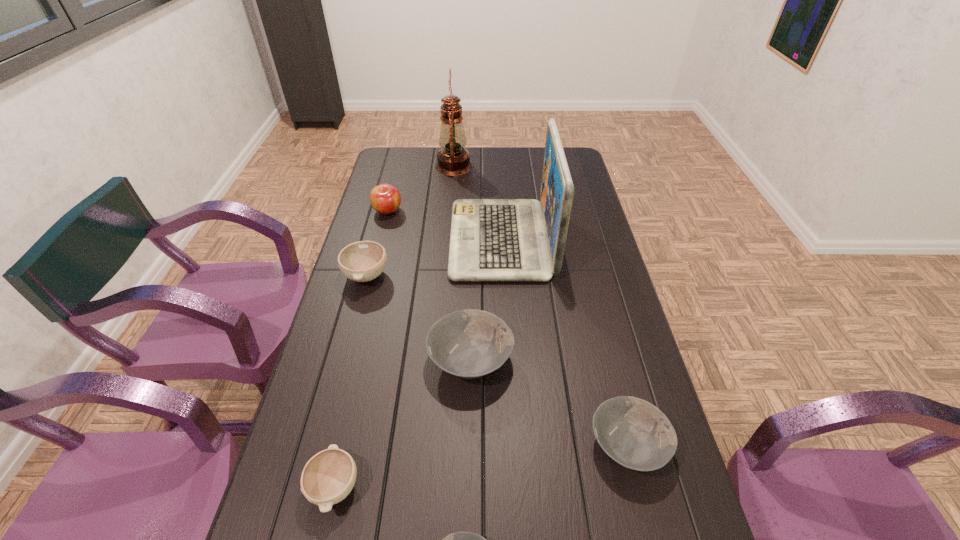
Identify the location of object identified as the seventh closest to the bigger beige bowl. The height and width of the screenshot is (540, 960). (458, 539).

Locate which object is the second closest to the farthest bowl. Please provide its 2D coordinates. Your answer should be formatted as a tuple, i.e. [(x, y)], where the tuple contains the x and y coordinates of a point satisfying the conditions above.

[(470, 343)]

Select which bowl appears as the fourth closest to the nearest bowl. Please provide its 2D coordinates. Your answer should be formatted as a tuple, i.e. [(x, y)], where the tuple contains the x and y coordinates of a point satisfying the conditions above.

[(362, 261)]

I want to click on bowl identified as the fifth closest to the laptop computer, so click(x=458, y=539).

Point out which gray bowl is positioned as the nearest to the second farthest bowl. Please provide its 2D coordinates. Your answer should be formatted as a tuple, i.e. [(x, y)], where the tuple contains the x and y coordinates of a point satisfying the conditions above.

[(634, 433)]

Identify which gray bowl is the second nearest to the shortest object. Please provide its 2D coordinates. Your answer should be formatted as a tuple, i.e. [(x, y)], where the tuple contains the x and y coordinates of a point satisfying the conditions above.

[(470, 343)]

At what (x,y) coordinates should I click in order to perform the action: click on free space that satisfies the following two spatial constraints: 1. on the back side of the smaller beige bowl; 2. on the left side of the fourth nearest bowl. Please return your answer as a coordinate pair (x, y). Image resolution: width=960 pixels, height=540 pixels. Looking at the image, I should click on (364, 359).

Locate an element on the screen. The image size is (960, 540). free region that satisfies the following two spatial constraints: 1. on the screen of the laptop computer; 2. on the left side of the second smallest gray bowl is located at coordinates (513, 444).